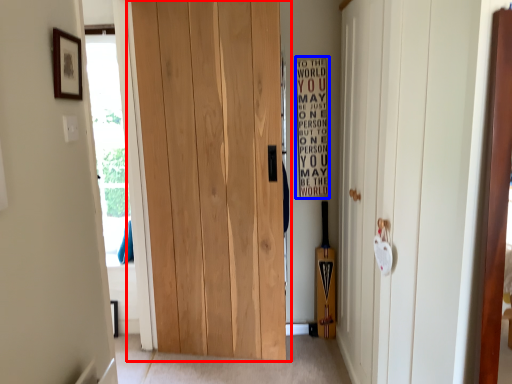
Question: Which of the following is the farthest to the observer, door (highlighted by a red box) or bulletin board (highlighted by a blue box)?

Choices:
 (A) door
 (B) bulletin board

Answer: (B)